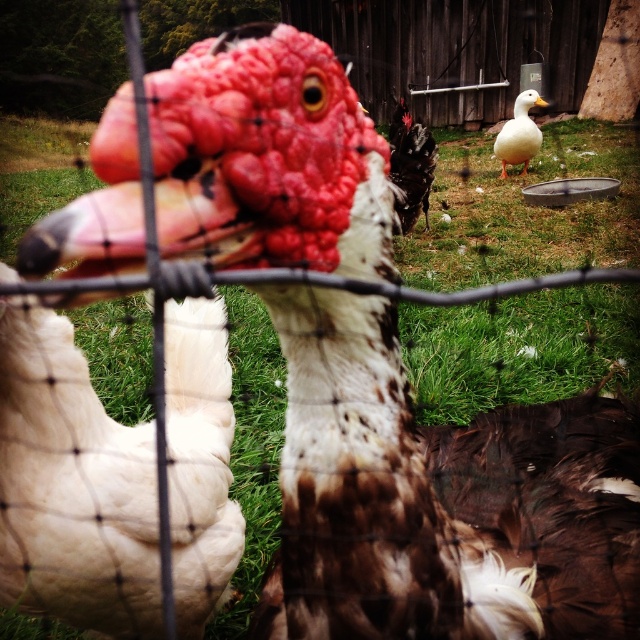
Where is `white fluffy chicken at left`? white fluffy chicken at left is located at coordinates (72, 486).

Is white fluffy chicken at left to the left of white matte duck at upper right from the viewer's perspective?

Indeed, white fluffy chicken at left is positioned on the left side of white matte duck at upper right.

Between point (52, 582) and point (524, 125), which one is positioned in front?

Point (52, 582)

You are a GUI agent. You are given a task and a screenshot of the screen. Output one action in this format:
    pyautogui.click(x=<x>, y=<y>)
    Task: Click on the white fluffy chicken at left
    Image resolution: width=640 pixels, height=640 pixels.
    Given the screenshot: What is the action you would take?
    pyautogui.click(x=72, y=486)